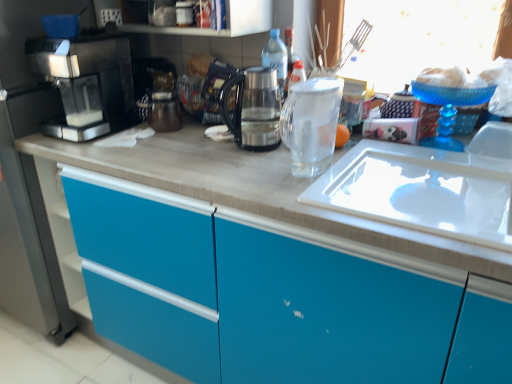
This screenshot has width=512, height=384. I want to click on vacant space to the right of transparent glass at center, so click(x=401, y=157).